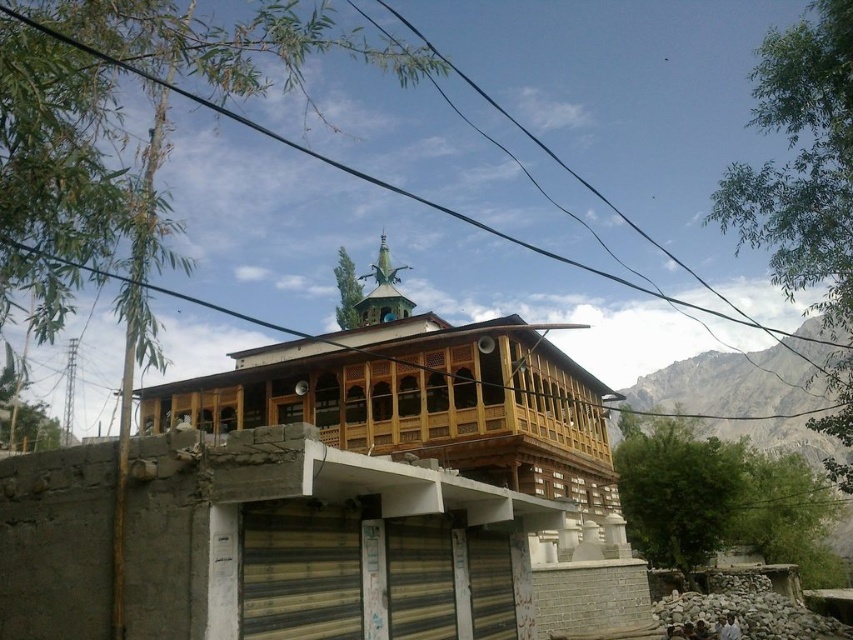
You are standing in front of a traditional building with a wooden mosque at center and a black wire at upper center. Which object is closer to you?

The wooden mosque at center is closer to you than the black wire at upper center.

You are a photographer planning to capture the wooden mosque at center and the black wire at upper center in a single frame. Based on their sizes in the image, which object should you focus on first to ensure both are clearly visible in the photo?

The wooden mosque at center occupies less space than the black wire at upper center, so you should focus on the wooden mosque at center first to ensure both are clearly visible in the photo.

You are a photographer planning to capture the wooden mosque at center and the black wire at upper center in a single frame. Based on their sizes, which object should you focus on to ensure both are clearly visible without cropping?

The wooden mosque at center is narrower than the black wire at upper center, so focusing on the black wire at upper center would allow both objects to fit within the frame more easily.